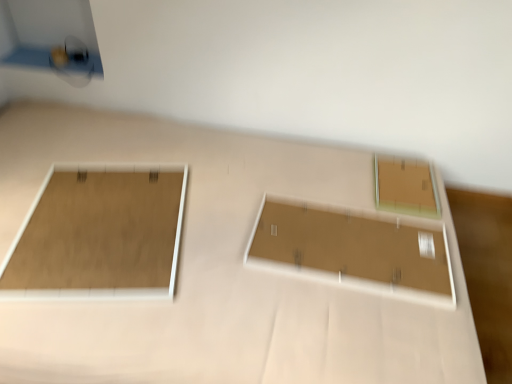
Question: Can you confirm if matte brown board at center, arranged as the second rectangle when viewed from the right, is taller than matte brown frame at left, which ranks as the 1th rectangle in left-to-right order?

Choices:
 (A) no
 (B) yes

Answer: (B)

Question: Considering the relative positions of matte brown board at center, arranged as the second rectangle when viewed from the right, and matte brown frame at left, the third rectangle positioned from the right, in the image provided, is matte brown board at center, arranged as the second rectangle when viewed from the right, to the right of matte brown frame at left, the third rectangle positioned from the right, from the viewer's perspective?

Choices:
 (A) no
 (B) yes

Answer: (B)

Question: From a real-world perspective, is matte brown board at center, arranged as the second rectangle when viewed from the right, located higher than matte brown frame at left, which ranks as the 1th rectangle in left-to-right order?

Choices:
 (A) yes
 (B) no

Answer: (B)

Question: Can you confirm if matte brown board at center, arranged as the second rectangle when viewed from the right, is bigger than matte brown frame at left, the third rectangle positioned from the right?

Choices:
 (A) no
 (B) yes

Answer: (A)

Question: Would you say matte brown frame at left, the third rectangle positioned from the right, is part of matte brown board at center, arranged as the second rectangle when viewed from the right,'s contents?

Choices:
 (A) no
 (B) yes

Answer: (A)

Question: From their relative heights in the image, would you say matte brown frame at left, which ranks as the 1th rectangle in left-to-right order, is taller or shorter than matte brown board at center, the second rectangle when ordered from left to right?

Choices:
 (A) short
 (B) tall

Answer: (A)

Question: From the image's perspective, is matte brown frame at left, which ranks as the 1th rectangle in left-to-right order, positioned above or below matte brown board at center, the second rectangle when ordered from left to right?

Choices:
 (A) above
 (B) below

Answer: (A)

Question: Do you think matte brown frame at left, which ranks as the 1th rectangle in left-to-right order, is within matte brown board at center, the second rectangle when ordered from left to right, or outside of it?

Choices:
 (A) outside
 (B) inside

Answer: (A)

Question: Based on their sizes in the image, would you say matte brown frame at left, the third rectangle positioned from the right, is bigger or smaller than matte brown board at center, arranged as the second rectangle when viewed from the right?

Choices:
 (A) small
 (B) big

Answer: (B)

Question: Considering the relative positions of matte brown board at center, arranged as the second rectangle when viewed from the right, and matte brown frame at left, the third rectangle positioned from the right, in the image provided, is matte brown board at center, arranged as the second rectangle when viewed from the right, to the left or to the right of matte brown frame at left, the third rectangle positioned from the right,?

Choices:
 (A) left
 (B) right

Answer: (B)

Question: From their relative heights in the image, would you say matte brown board at center, arranged as the second rectangle when viewed from the right, is taller or shorter than matte brown frame at left, the third rectangle positioned from the right?

Choices:
 (A) tall
 (B) short

Answer: (A)

Question: In terms of width, does matte brown board at center, the second rectangle when ordered from left to right, look wider or thinner when compared to matte brown frame at left, which ranks as the 1th rectangle in left-to-right order?

Choices:
 (A) thin
 (B) wide

Answer: (B)

Question: From the image's perspective, is matte brown board at center, the second rectangle when ordered from left to right, above or below matte brown frame at left, which ranks as the 1th rectangle in left-to-right order?

Choices:
 (A) above
 (B) below

Answer: (B)

Question: Is point (170, 205) positioned closer to the camera than point (384, 180)?

Choices:
 (A) farther
 (B) closer

Answer: (B)

Question: Is matte brown frame at left, which ranks as the 1th rectangle in left-to-right order, bigger or smaller than matte brown frame at upper right, marked as the third rectangle in a left-to-right arrangement?

Choices:
 (A) big
 (B) small

Answer: (A)